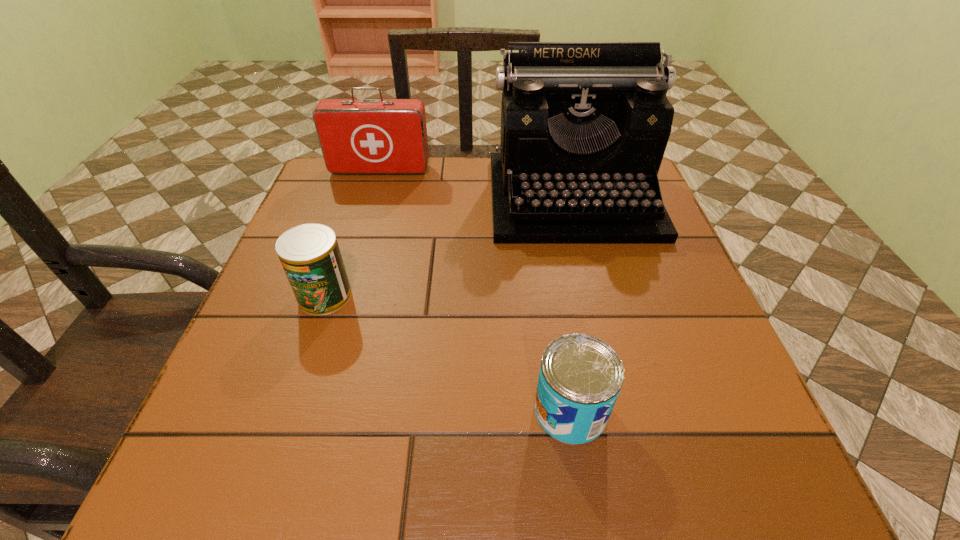
This screenshot has width=960, height=540. I want to click on free area in between the shorter can and the tallest object, so click(571, 304).

You are a GUI agent. You are given a task and a screenshot of the screen. Output one action in this format:
    pyautogui.click(x=<x>, y=<y>)
    Task: Click on the free space between the left can and the typewriter
    The width and height of the screenshot is (960, 540).
    Given the screenshot: What is the action you would take?
    pyautogui.click(x=448, y=247)

The height and width of the screenshot is (540, 960). I want to click on free space between the right can and the second nearest object, so click(x=447, y=353).

You are a GUI agent. You are given a task and a screenshot of the screen. Output one action in this format:
    pyautogui.click(x=<x>, y=<y>)
    Task: Click on the object that is the second nearest to the right can
    Image resolution: width=960 pixels, height=540 pixels.
    Given the screenshot: What is the action you would take?
    pyautogui.click(x=310, y=256)

You are a GUI agent. You are given a task and a screenshot of the screen. Output one action in this format:
    pyautogui.click(x=<x>, y=<y>)
    Task: Click on the object that is the third closest to the third farthest object
    This screenshot has width=960, height=540.
    Given the screenshot: What is the action you would take?
    pyautogui.click(x=357, y=136)

Where is `free point that satisfies the following two spatial constraints: 1. on the side of the nearest object with the first aid cross symbol; 2. on the left side of the first-aid kit`? Image resolution: width=960 pixels, height=540 pixels. free point that satisfies the following two spatial constraints: 1. on the side of the nearest object with the first aid cross symbol; 2. on the left side of the first-aid kit is located at coordinates (308, 410).

The image size is (960, 540). I want to click on vacant space that satisfies the following two spatial constraints: 1. on the side of the third shortest object with the first aid cross symbol; 2. on the right side of the nearer can, so click(308, 410).